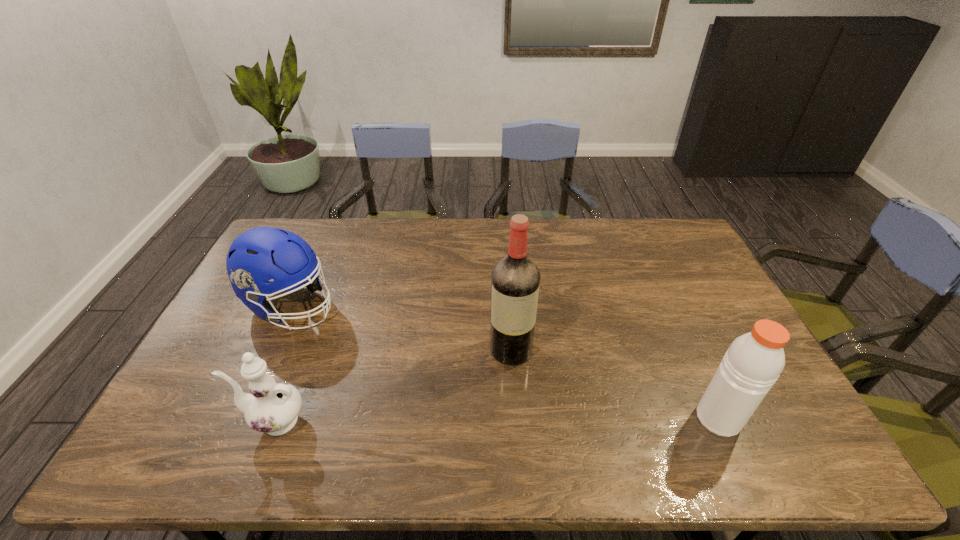
Where is `vacant space on the desktop that is between the chinaware and the rightmost object and is positioned on the front-facing side of the liquor`? The height and width of the screenshot is (540, 960). vacant space on the desktop that is between the chinaware and the rightmost object and is positioned on the front-facing side of the liquor is located at coordinates (516, 420).

The height and width of the screenshot is (540, 960). I want to click on vacant space on the desktop that is between the chinaware and the rightmost object and is positioned on the front-facing side of the football helmet, so 521,420.